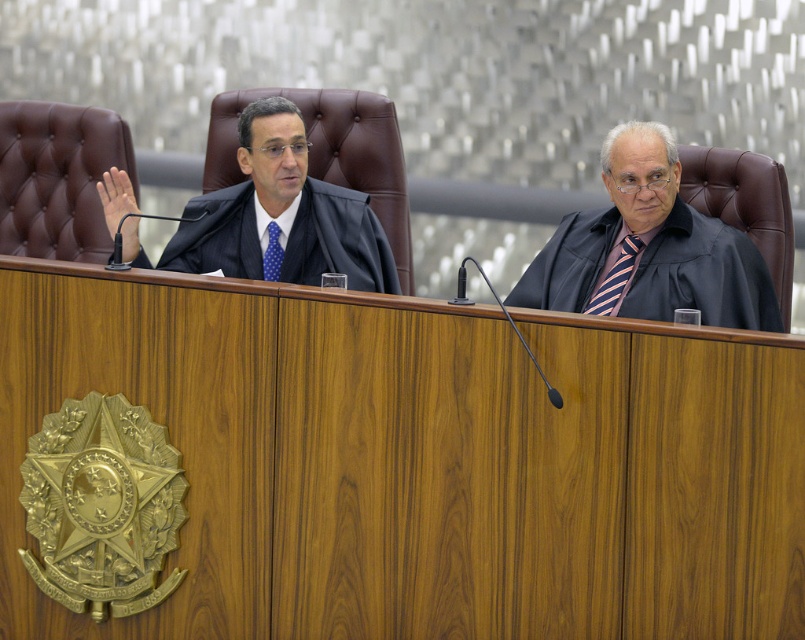
You are an observer in the courtroom. You notice two individuals wearing matte black robe at right and matte black robe at left. Which robe appears taller in the image?

The matte black robe at right is much taller as the matte black robe at left.

You are an observer in the courtroom. You notice the matte black robe at right and the blue dotted tie at center. Which object is positioned higher in the image?

The matte black robe at right is taller than the blue dotted tie at center, so the matte black robe at right is positioned higher in the image.